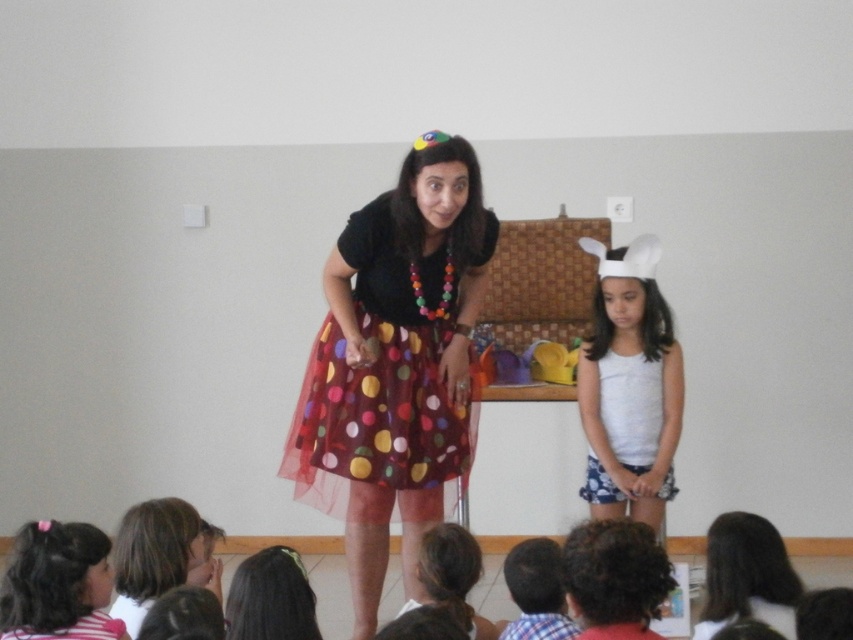
You are a photographer trying to capture a closeup shot of the polka dot tulle skirt at center and the brown hair at lower center. Which object will appear bigger in your photo?

The polka dot tulle skirt at center will appear bigger in the photo because it is larger in size than the brown hair at lower center.

You are a photographer setting up for a group photo. You notice a white matte tank top at center and a plaid fabric shirt at lower center. Which clothing item is positioned more to the right side of the scene?

The white matte tank top at center is positioned to the right of the plaid fabric shirt at lower center, so the white matte tank top at center is more to the right side of the scene.